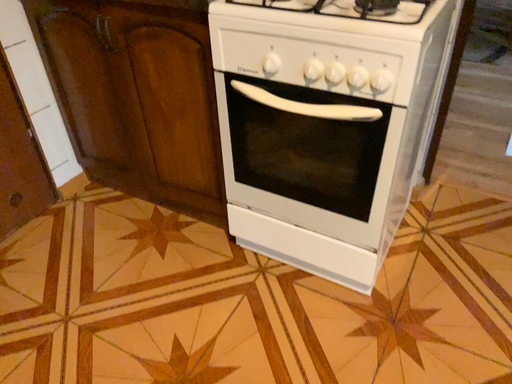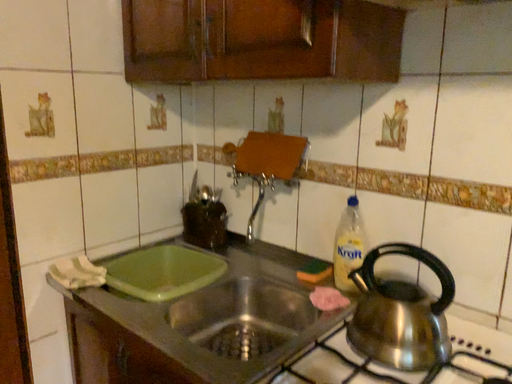
Question: How did the camera likely rotate when shooting the video?

Choices:
 (A) rotated upward
 (B) rotated downward

Answer: (A)